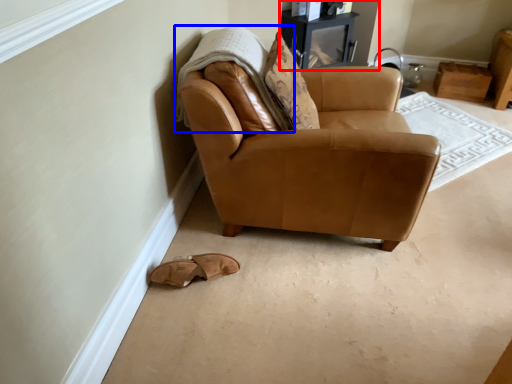
Question: Which object appears farthest to the camera in this image, entertainment center (highlighted by a red box) or blanket (highlighted by a blue box)?

Choices:
 (A) entertainment center
 (B) blanket

Answer: (A)